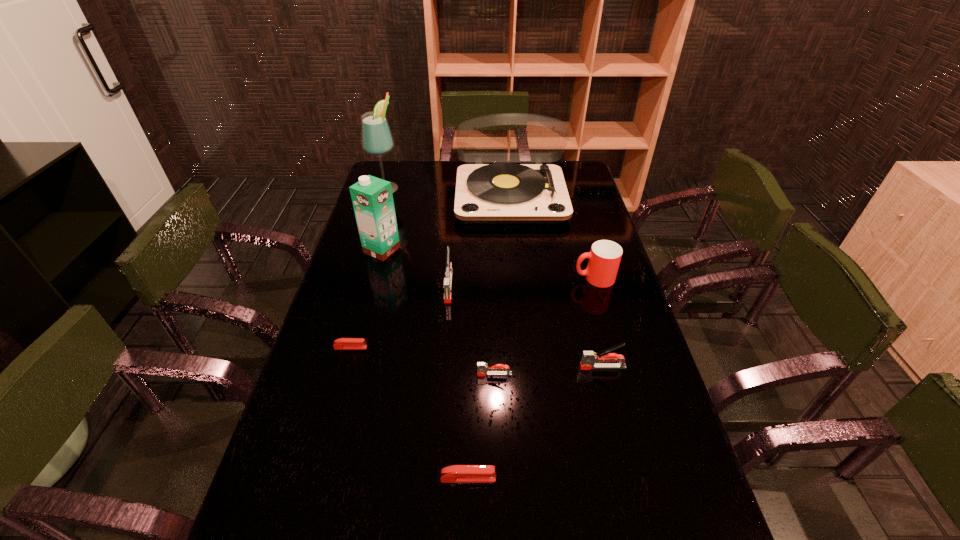
Image resolution: width=960 pixels, height=540 pixels. I want to click on free space between the second tallest stapler and the fourth tallest stapler, so click(x=536, y=423).

Find the location of a particular element. This screenshot has width=960, height=540. vacant region between the second shortest object and the leftmost stapler is located at coordinates coord(409,413).

At what (x,y) coordinates should I click in order to perform the action: click on vacant space in between the second gray stapler from right to left and the farthest stapler. Please return your answer as a coordinate pair (x, y). This screenshot has width=960, height=540. Looking at the image, I should click on (471, 330).

Locate an element on the screen. object that can be found as the second closest to the third shortest stapler is located at coordinates (456, 473).

Locate which object ranks fifth in proximity to the farthest gray stapler. Please provide its 2D coordinates. Your answer should be formatted as a tuple, i.e. [(x, y)], where the tuple contains the x and y coordinates of a point satisfying the conditions above.

[(604, 258)]

Identify which stapler is located as the fourth nearest to the alcohol. Please provide its 2D coordinates. Your answer should be formatted as a tuple, i.e. [(x, y)], where the tuple contains the x and y coordinates of a point satisfying the conditions above.

[(588, 360)]

Locate an element on the screen. stapler that is the third closest to the record player is located at coordinates coord(588,360).

Identify which gray stapler is the second nearest to the record player. Please provide its 2D coordinates. Your answer should be formatted as a tuple, i.e. [(x, y)], where the tuple contains the x and y coordinates of a point satisfying the conditions above.

[(588, 360)]

Where is `the closest gray stapler to the leftmost gray stapler`? The height and width of the screenshot is (540, 960). the closest gray stapler to the leftmost gray stapler is located at coordinates (483, 369).

Where is `vacant space that satisfies the following two spatial constraints: 1. on the front side of the seventh nearest object; 2. on the side of the red cup with the handle`? vacant space that satisfies the following two spatial constraints: 1. on the front side of the seventh nearest object; 2. on the side of the red cup with the handle is located at coordinates (374, 278).